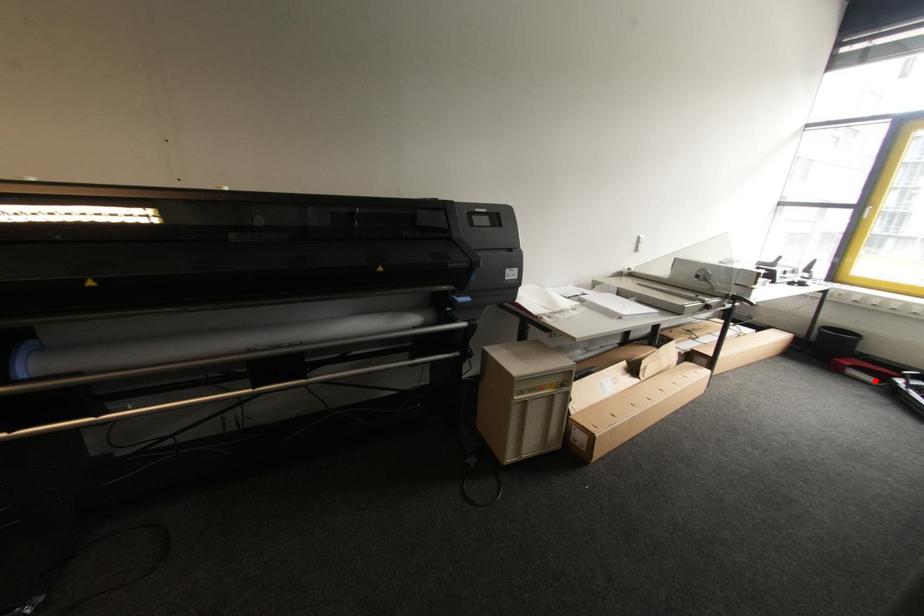
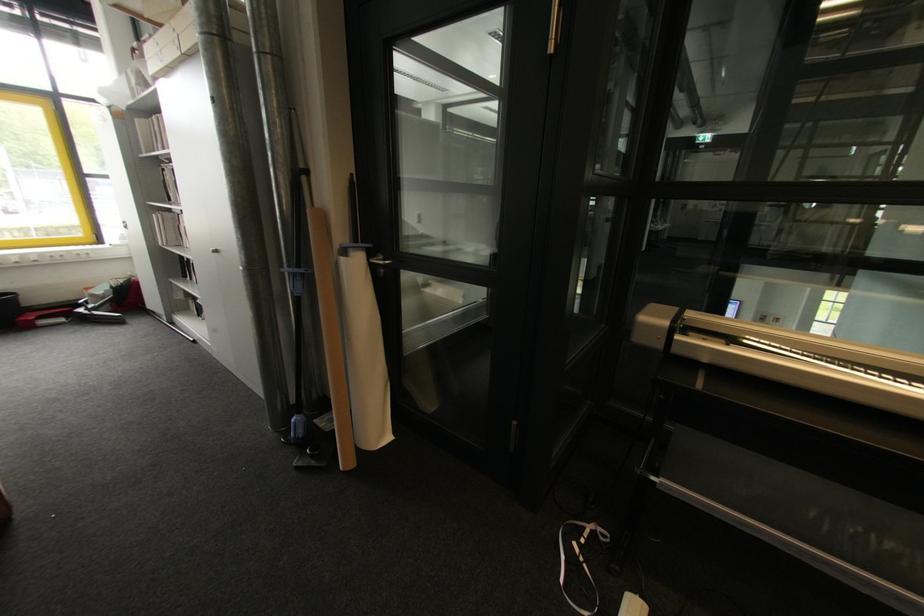
Question: I am providing you with two images of the same scene from different viewpoints. In image1, a red point is highlighted. Considering the same 3D point in image2, which of the following is correct?

Choices:
 (A) It is closer
 (B) It is farther

Answer: (A)